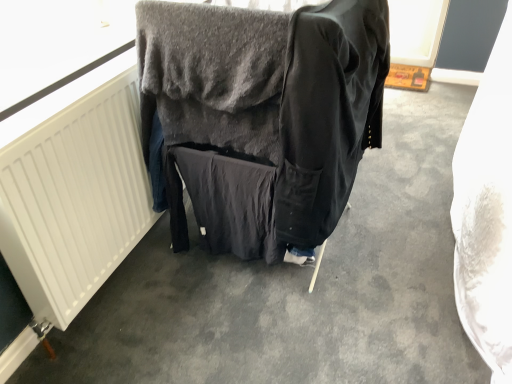
Question: Is point (329, 216) positioned closer to the camera than point (23, 284)?

Choices:
 (A) farther
 (B) closer

Answer: (A)

Question: Looking at their shapes, would you say black cotton jacket at center is wider or thinner than white matte radiator at left?

Choices:
 (A) wide
 (B) thin

Answer: (A)

Question: Which object is the farthest from the black cotton jacket at center?

Choices:
 (A) dark gray fabric at center
 (B) white matte radiator at left

Answer: (B)

Question: Considering the real-world distances, which object is closest to the dark gray fabric at center?

Choices:
 (A) black cotton jacket at center
 (B) white matte radiator at left

Answer: (A)